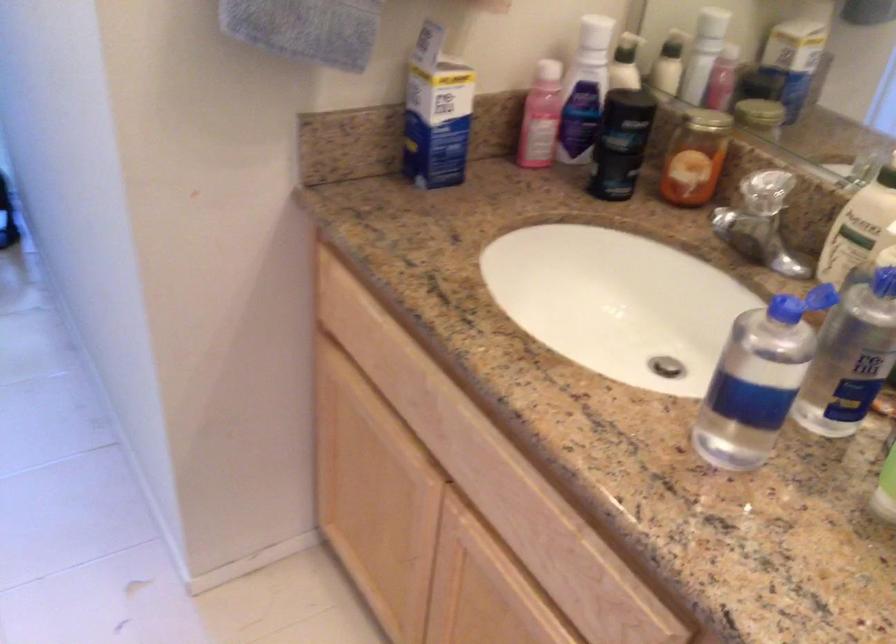
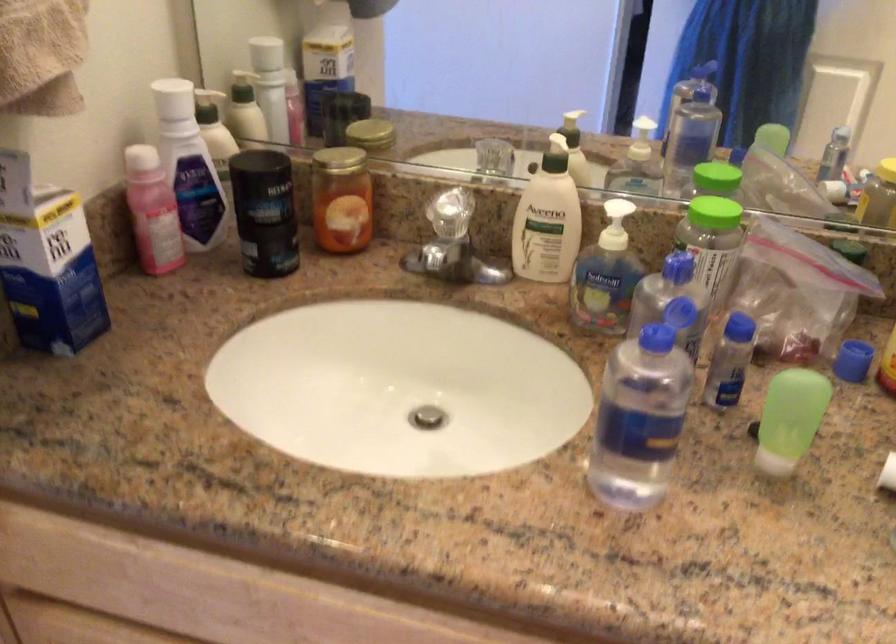
In the second image, find the point that corresponds to [530,111] in the first image.

(152, 211)